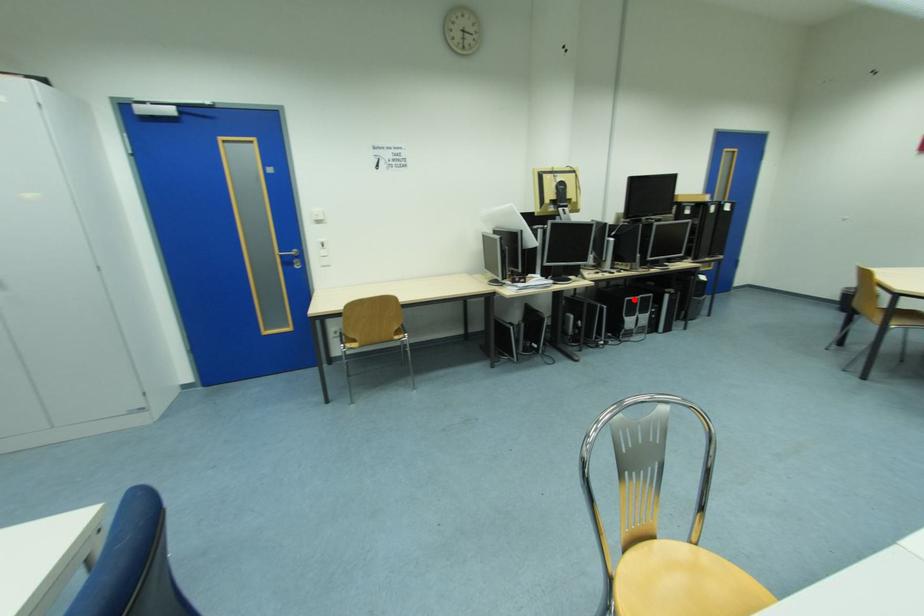
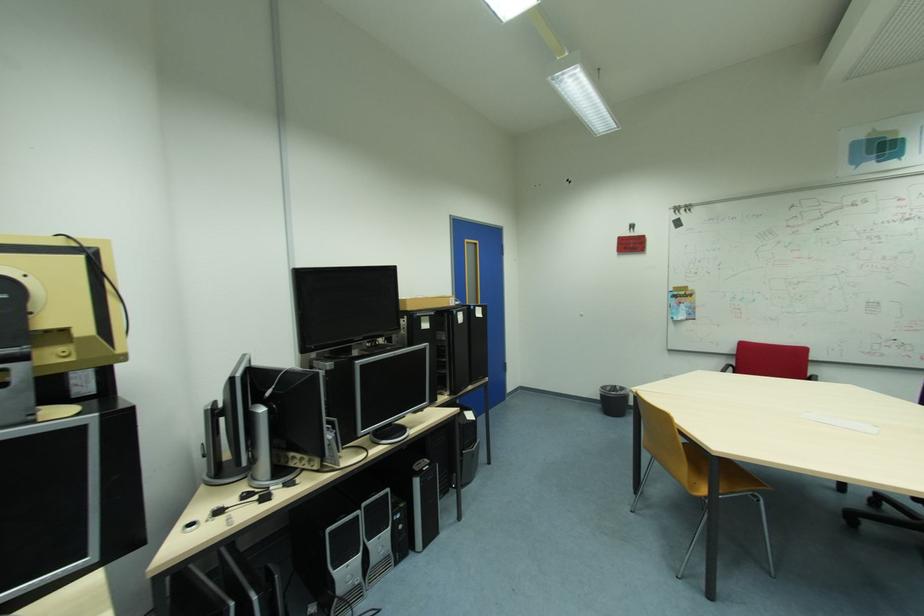
Where in the second image is the point corresponding to the highlighted location from the first image?

(335, 530)